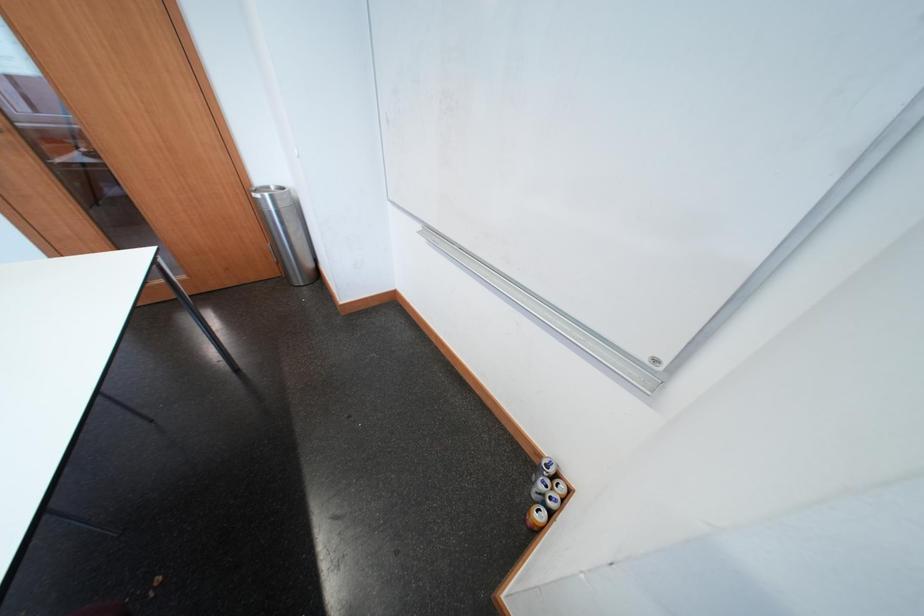
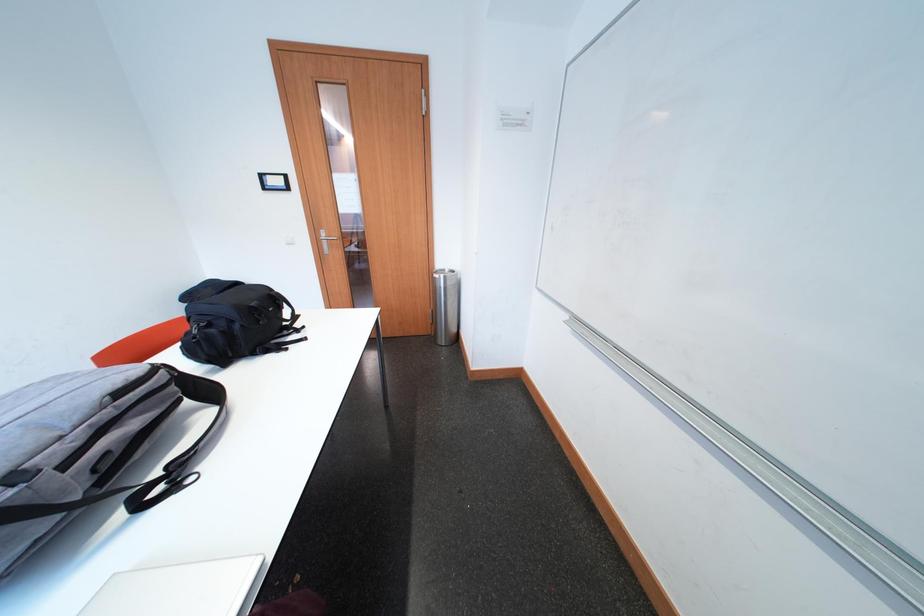
Question: The first image is from the beginning of the video and the second image is from the end. How did the camera likely rotate when shooting the video?

Choices:
 (A) Left
 (B) Right
 (C) Up
 (D) Down

Answer: (A)